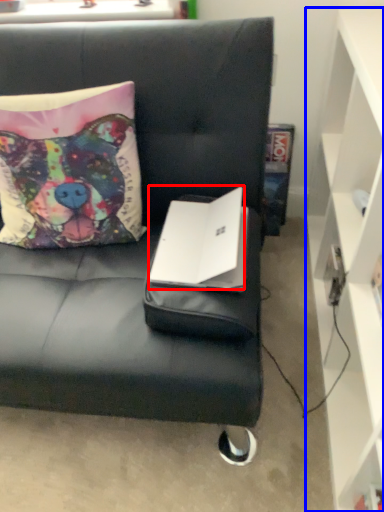
Question: Which object appears farthest to the camera in this image, laptop (highlighted by a red box) or cabinetry (highlighted by a blue box)?

Choices:
 (A) laptop
 (B) cabinetry

Answer: (A)